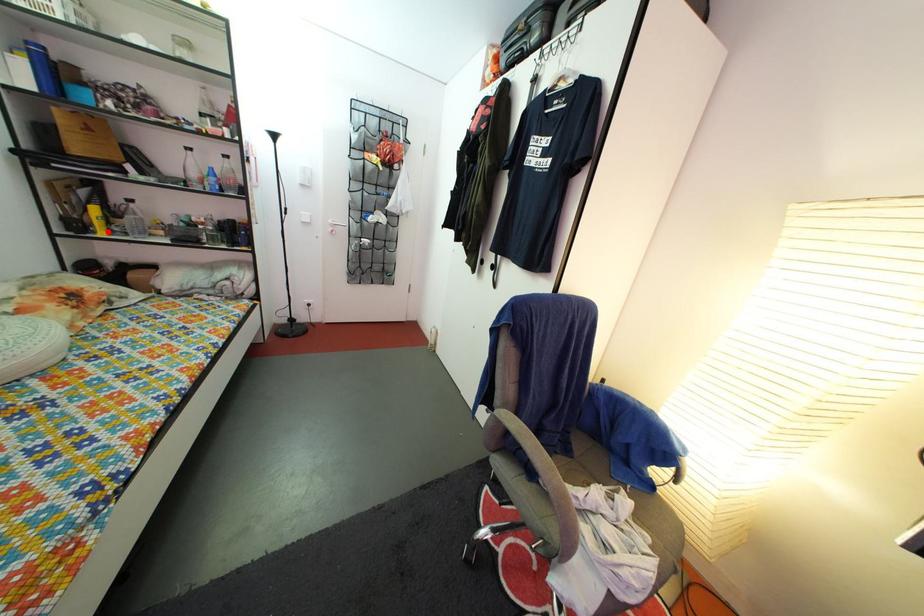
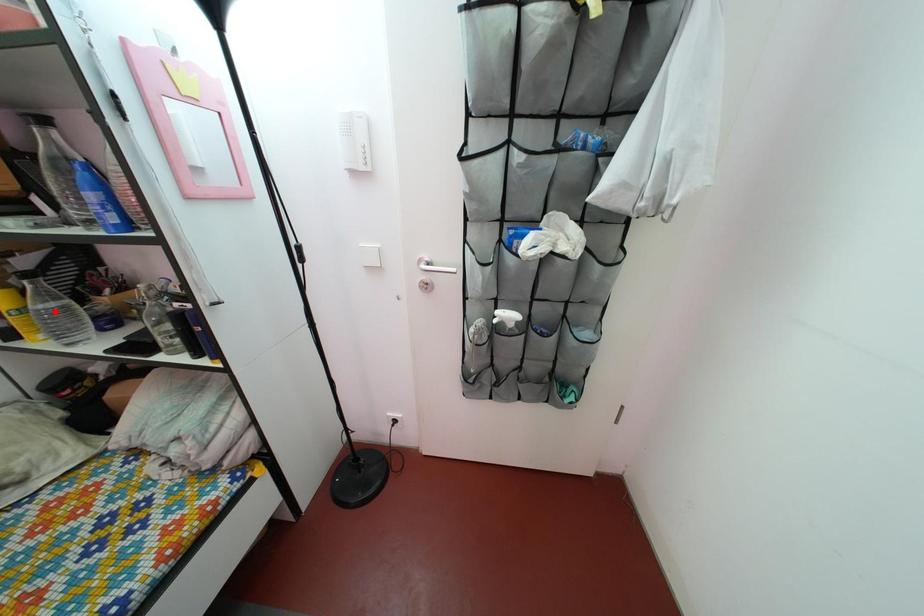
I am providing you with two images of the same scene from different viewpoints. A red point is marked on the first image and another point is marked on the second image. Is the marked point in image1 the same physical position as the marked point in image2?

No